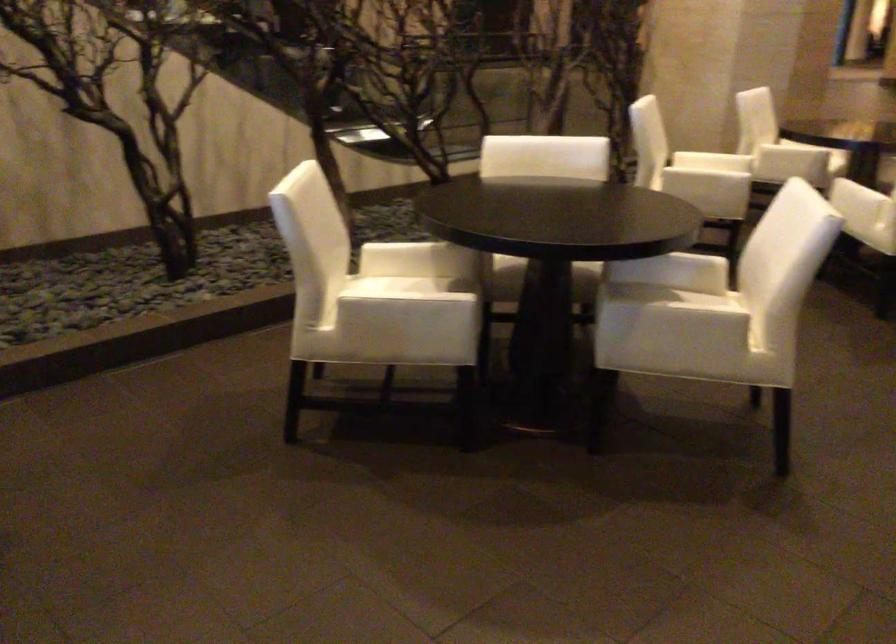
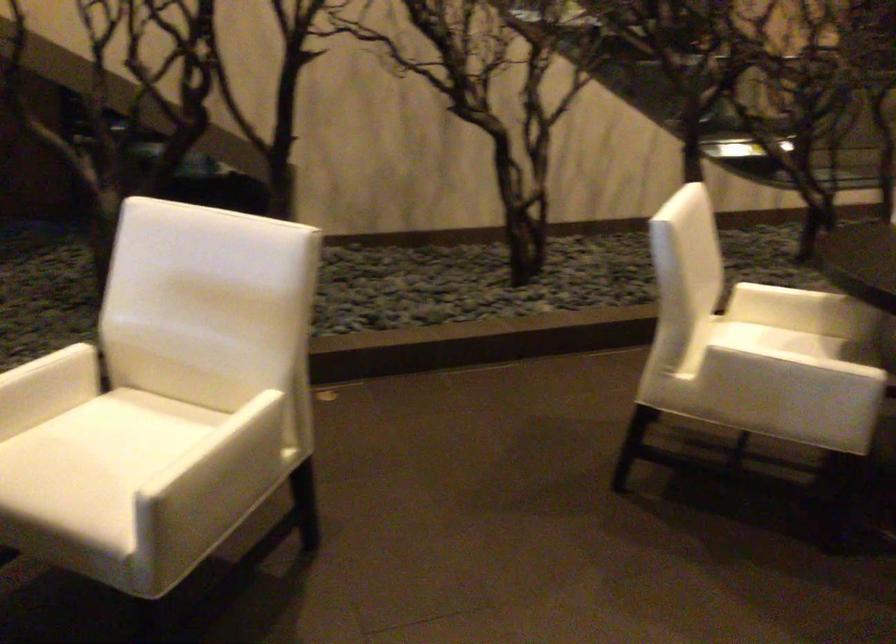
The point at (391, 313) is marked in the first image. Where is the corresponding point in the second image?

(771, 371)